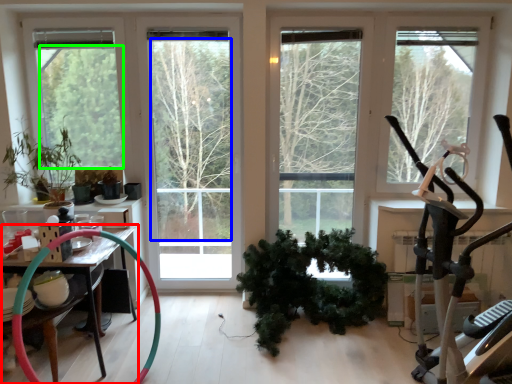
Question: Based on their relative distances, which object is nearer to table (highlighted by a red box)? Choose from tree (highlighted by a blue box) and tree (highlighted by a green box).

Choices:
 (A) tree
 (B) tree

Answer: (B)